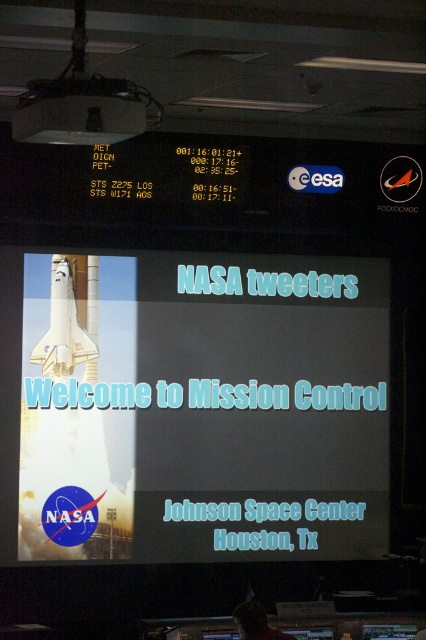
Question: Can you confirm if white glossy rocket at center is positioned below white matte shuttle at center?

Choices:
 (A) no
 (B) yes

Answer: (B)

Question: Which point is farther to the camera?

Choices:
 (A) (203, 506)
 (B) (68, 296)

Answer: (A)

Question: Does white glossy rocket at center appear under white matte shuttle at center?

Choices:
 (A) yes
 (B) no

Answer: (A)

Question: Is white glossy rocket at center thinner than white matte shuttle at center?

Choices:
 (A) yes
 (B) no

Answer: (B)

Question: Which point is closer to the camera?

Choices:
 (A) white glossy rocket at center
 (B) white matte shuttle at center

Answer: (A)

Question: Which object appears farthest from the camera in this image?

Choices:
 (A) white matte shuttle at center
 (B) white glossy rocket at center

Answer: (A)